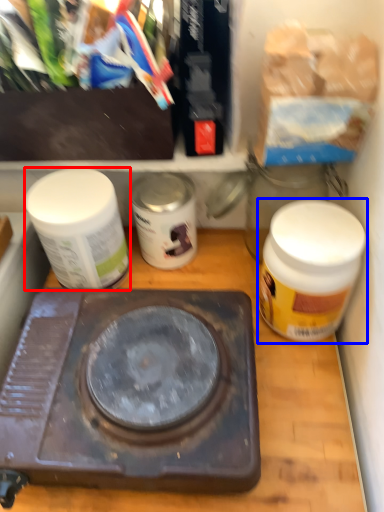
Question: Which point is closer to the camera, bottle (highlighted by a red box) or bottle (highlighted by a blue box)?

Choices:
 (A) bottle
 (B) bottle

Answer: (B)